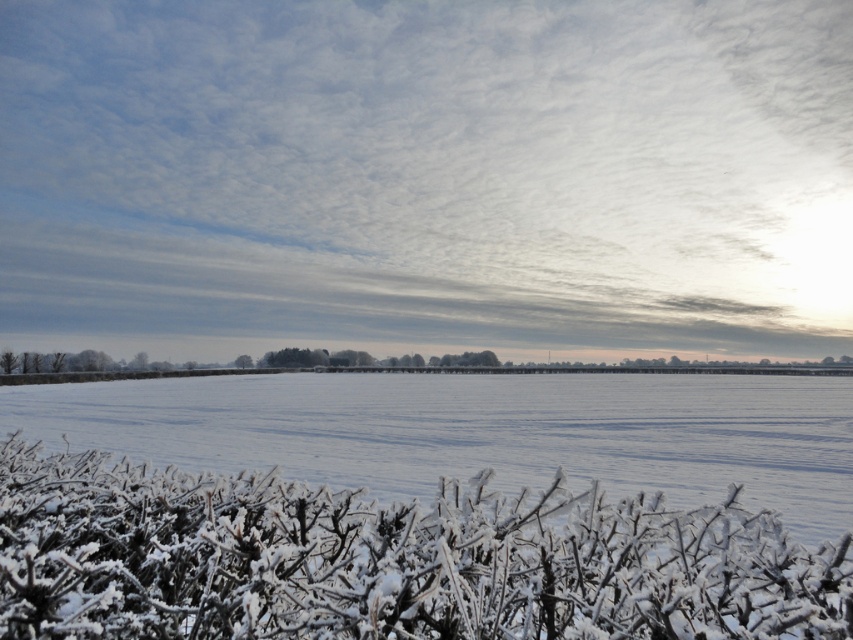
Question: In this image, where is white frosty bush at lower center located relative to white frosty plain at lower center?

Choices:
 (A) above
 (B) below

Answer: (A)

Question: Is white frosty bush at lower center positioned behind white frosty plain at lower center?

Choices:
 (A) no
 (B) yes

Answer: (A)

Question: Based on their relative distances, which object is farther from the white fluffy cloud at upper center?

Choices:
 (A) white frosty plain at lower center
 (B) white frosty bush at lower center

Answer: (B)

Question: Is white frosty bush at lower center to the right of white frosty plain at lower center from the viewer's perspective?

Choices:
 (A) yes
 (B) no

Answer: (A)

Question: Among these points, which one is farthest from the camera?

Choices:
 (A) (741, 540)
 (B) (103, 138)

Answer: (B)

Question: Which of the following is the closest to the observer?

Choices:
 (A) (252, 406)
 (B) (181, 209)
 (C) (6, 576)

Answer: (C)